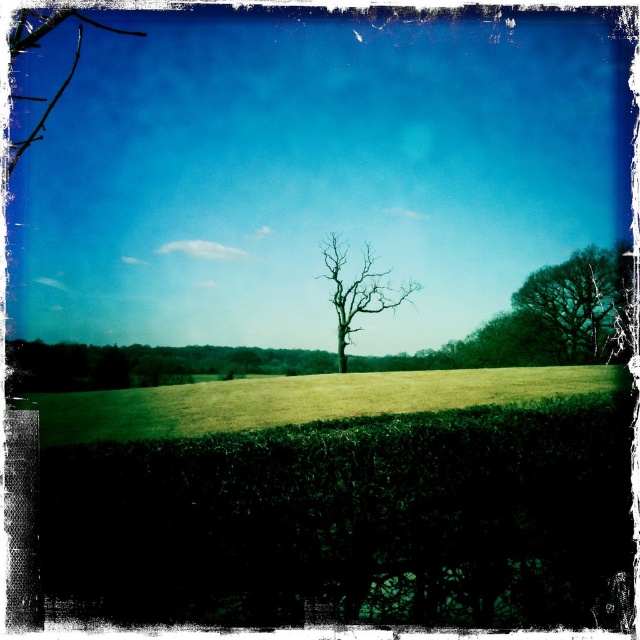
Question: Among these points, which one is nearest to the camera?

Choices:
 (A) (339, 365)
 (B) (605, 262)
 (C) (374, 381)
 (D) (580, 397)

Answer: (D)

Question: Is green leafy hedge at lower center bigger than green leafy tree at upper right?

Choices:
 (A) yes
 (B) no

Answer: (B)

Question: Does green grassy field at center have a greater width compared to green leafy tree at upper right?

Choices:
 (A) yes
 (B) no

Answer: (A)

Question: Estimate the real-world distances between objects in this image. Which object is farther from the green leafy tree at upper right?

Choices:
 (A) green leafy hedge at lower center
 (B) bare wood tree at center

Answer: (A)

Question: Can you confirm if green leafy hedge at lower center is positioned to the right of green leafy tree at upper right?

Choices:
 (A) yes
 (B) no

Answer: (B)

Question: Among these points, which one is farthest from the camera?

Choices:
 (A) (371, 474)
 (B) (332, 243)
 (C) (612, 257)
 (D) (266, 401)

Answer: (B)